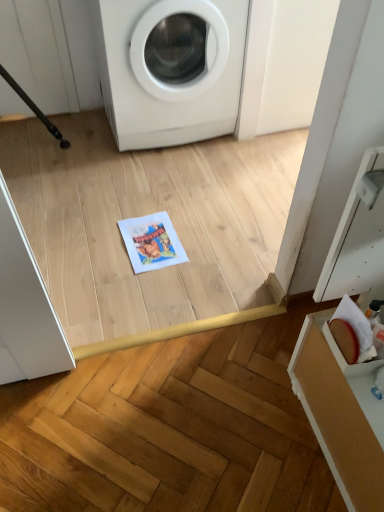
Question: Is point (158, 254) positioned closer to the camera than point (198, 128)?

Choices:
 (A) closer
 (B) farther

Answer: (A)

Question: Is printed paper at center bigger or smaller than white glossy washing machine at upper center?

Choices:
 (A) big
 (B) small

Answer: (B)

Question: Is printed paper at center taller or shorter than white glossy washing machine at upper center?

Choices:
 (A) tall
 (B) short

Answer: (B)

Question: Would you say white glossy washing machine at upper center is to the left or to the right of printed paper at center in the picture?

Choices:
 (A) left
 (B) right

Answer: (B)

Question: Do you think white glossy washing machine at upper center is within printed paper at center, or outside of it?

Choices:
 (A) inside
 (B) outside

Answer: (B)

Question: Considering the positions of white glossy washing machine at upper center and printed paper at center in the image, is white glossy washing machine at upper center taller or shorter than printed paper at center?

Choices:
 (A) tall
 (B) short

Answer: (A)

Question: From the image's perspective, is white glossy washing machine at upper center above or below printed paper at center?

Choices:
 (A) above
 (B) below

Answer: (A)